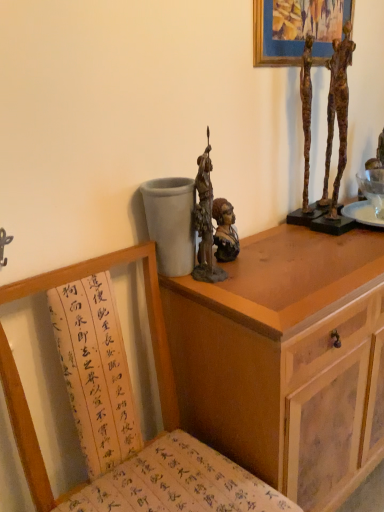
I want to click on vacant space behind bronze bust at center, placed as the 2th person when sorted from right to left, so click(257, 238).